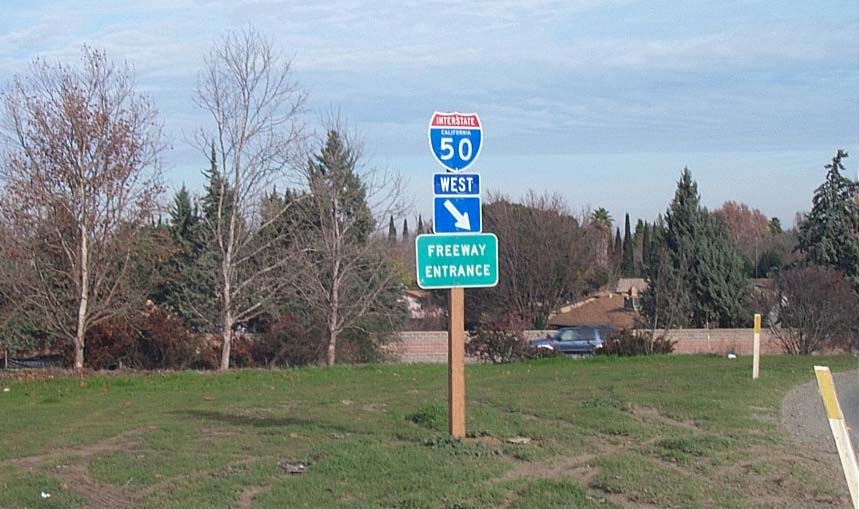
Locate an element on the screen. The width and height of the screenshot is (859, 509). brick wall is located at coordinates (722, 337).